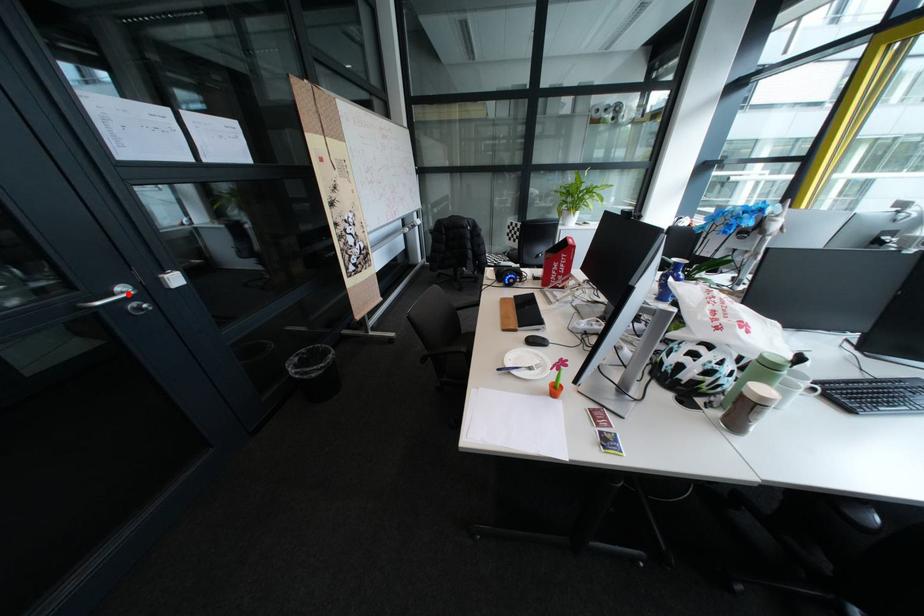
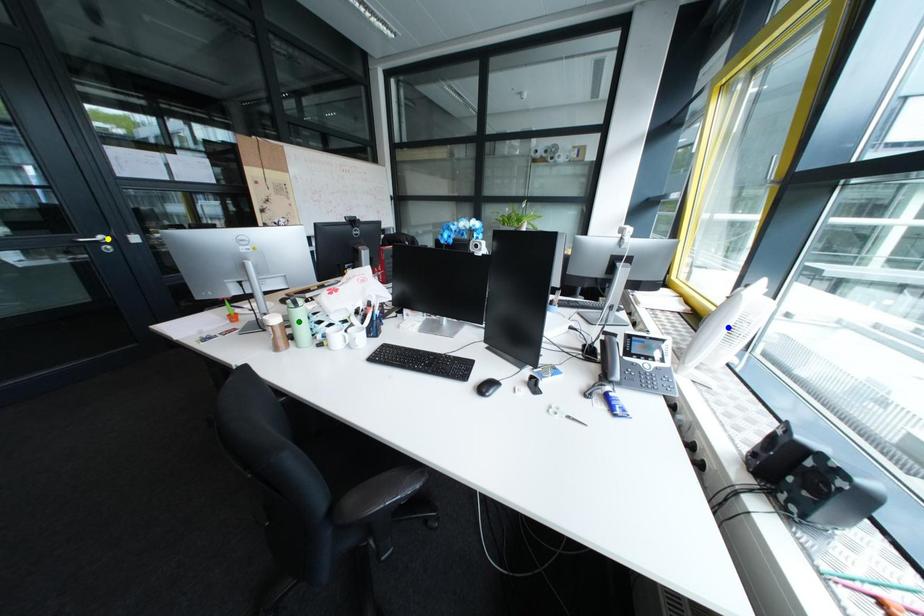
Question: I am providing you with two images of the same scene from different viewpoints. A red point is marked on the first image. You are given multiple points on the second image. Which point in image 2 represents the same 3d spot as the red point in image 1?

Choices:
 (A) blue point
 (B) yellow point
 (C) green point

Answer: (B)